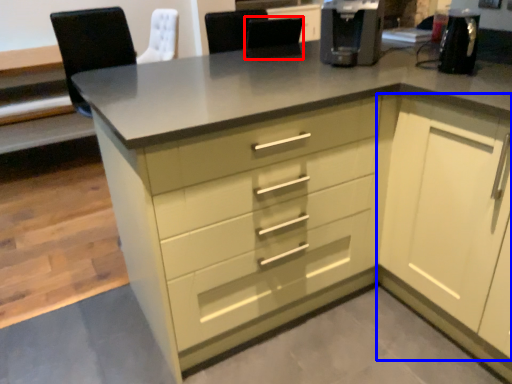
Question: Which of the following is the farthest to the observer, chair (highlighted by a red box) or cabinetry (highlighted by a blue box)?

Choices:
 (A) chair
 (B) cabinetry

Answer: (A)